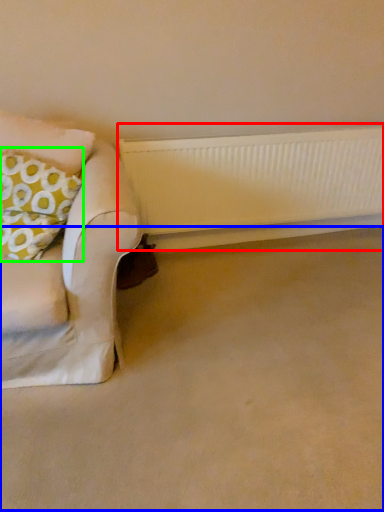
Question: Which object is positioned closest to radiator (highlighted by a red box)? Select from plain (highlighted by a blue box) and throw pillow (highlighted by a green box).

Choices:
 (A) plain
 (B) throw pillow

Answer: (A)